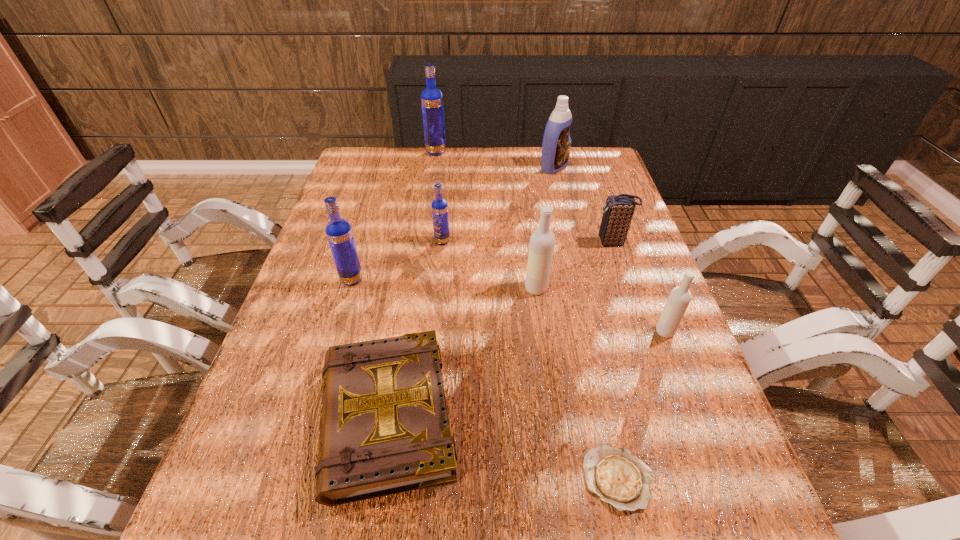
Locate which object is the third closest to the blue detergent. Please provide its 2D coordinates. Your answer should be formatted as a tuple, i.e. [(x, y)], where the tuple contains the x and y coordinates of a point satisfying the conditions above.

[(440, 216)]

Image resolution: width=960 pixels, height=540 pixels. What are the coordinates of `vodka identified as the fifth closest to the clutch bag` in the screenshot? It's located at (431, 98).

Identify which vodka is located as the third nearest to the seventh tallest object. Please provide its 2D coordinates. Your answer should be formatted as a tuple, i.e. [(x, y)], where the tuple contains the x and y coordinates of a point satisfying the conditions above.

[(440, 216)]

Identify which blue vodka is the third closest to the third nearest object. Please provide its 2D coordinates. Your answer should be formatted as a tuple, i.e. [(x, y)], where the tuple contains the x and y coordinates of a point satisfying the conditions above.

[(431, 98)]

Identify the location of blue vodka object that ranks as the closest to the brown hardback book. (338, 231).

This screenshot has width=960, height=540. In order to click on free space that satisfies the following two spatial constraints: 1. on the back side of the brown hardback book; 2. on the right side of the smallest blue vodka in this screenshot , I will do `click(416, 241)`.

This screenshot has width=960, height=540. Identify the location of vacant area that satisfies the following two spatial constraints: 1. on the back side of the second smallest blue vodka; 2. on the left side of the eighth nearest object. (386, 167).

You are a GUI agent. You are given a task and a screenshot of the screen. Output one action in this format:
    pyautogui.click(x=<x>, y=<y>)
    Task: Click on the free location that satisfies the following two spatial constraints: 1. with the zip open on the nearest vodka; 2. on the right side of the third shortest object
    The height and width of the screenshot is (540, 960).
    Given the screenshot: What is the action you would take?
    pyautogui.click(x=643, y=332)